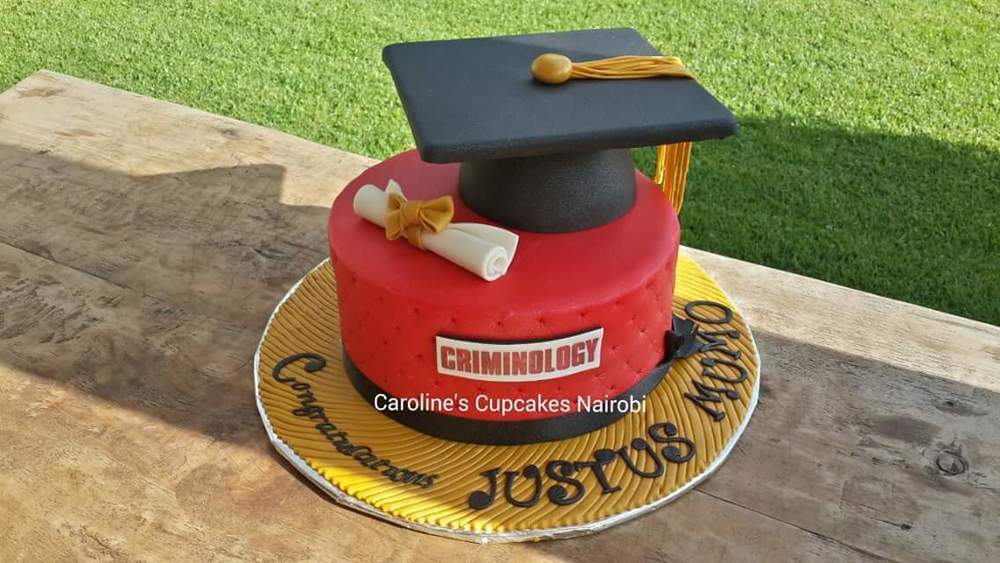
The width and height of the screenshot is (1000, 563). In order to click on wooden table in this screenshot , I will do `click(785, 473)`.